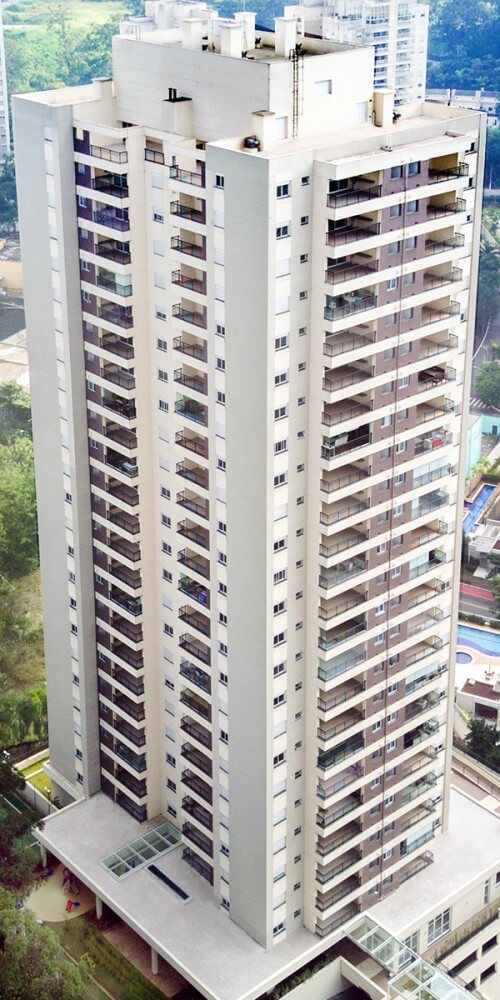
What are the coordinates of `air condition units` in the screenshot? It's located at (208, 47), (207, 34), (258, 37), (242, 50), (299, 44).